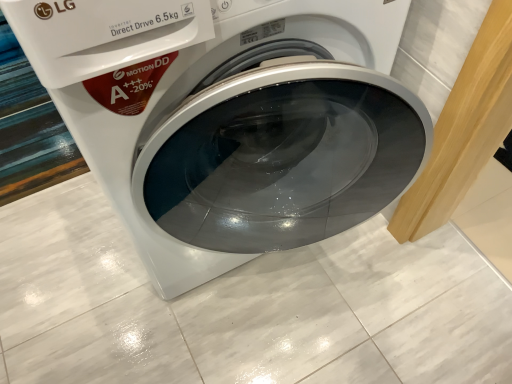
The image size is (512, 384). I want to click on vacant space to the left of white glossy washing machine at center, so click(68, 264).